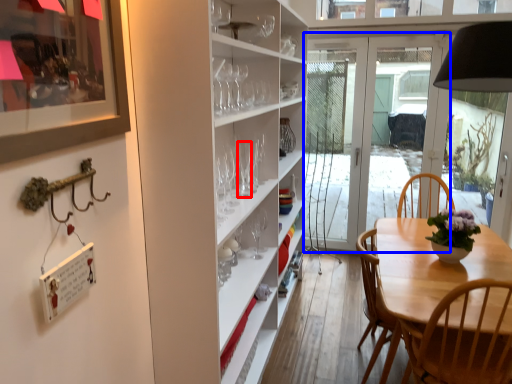
Question: Which object appears farthest to the camera in this image, wine glass (highlighted by a red box) or door (highlighted by a blue box)?

Choices:
 (A) wine glass
 (B) door

Answer: (B)